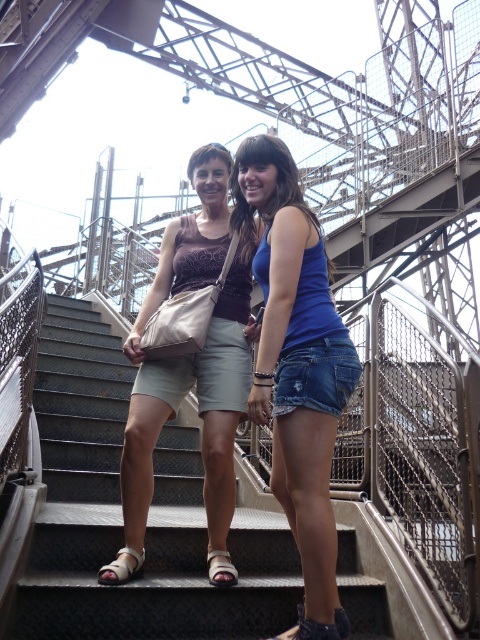
Question: Considering the relative positions of blue denim shorts at center and matte beige shorts at center in the image provided, where is blue denim shorts at center located with respect to matte beige shorts at center?

Choices:
 (A) right
 (B) left

Answer: (A)

Question: Which of these objects is positioned closest to the blue denim shorts at center?

Choices:
 (A) metal stairs at center
 (B) matte beige shorts at center

Answer: (B)

Question: Which of the following is the farthest from the observer?

Choices:
 (A) (321, 337)
 (B) (131, 413)
 (C) (144, 577)

Answer: (B)

Question: Among these points, which one is nearest to the camera?

Choices:
 (A) (52, 636)
 (B) (336, 422)

Answer: (A)

Question: Where is metal stairs at center located in relation to blue denim shorts at center in the image?

Choices:
 (A) left
 (B) right

Answer: (A)

Question: Is metal stairs at center behind matte beige shorts at center?

Choices:
 (A) no
 (B) yes

Answer: (A)